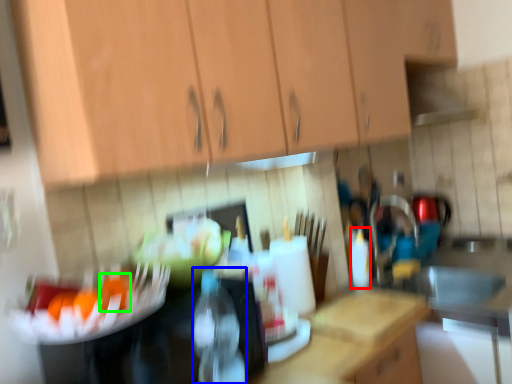
Question: Which object is positioned farthest from bottle (highlighted by a red box)? Select from bottle (highlighted by a blue box) and food (highlighted by a green box).

Choices:
 (A) bottle
 (B) food

Answer: (B)